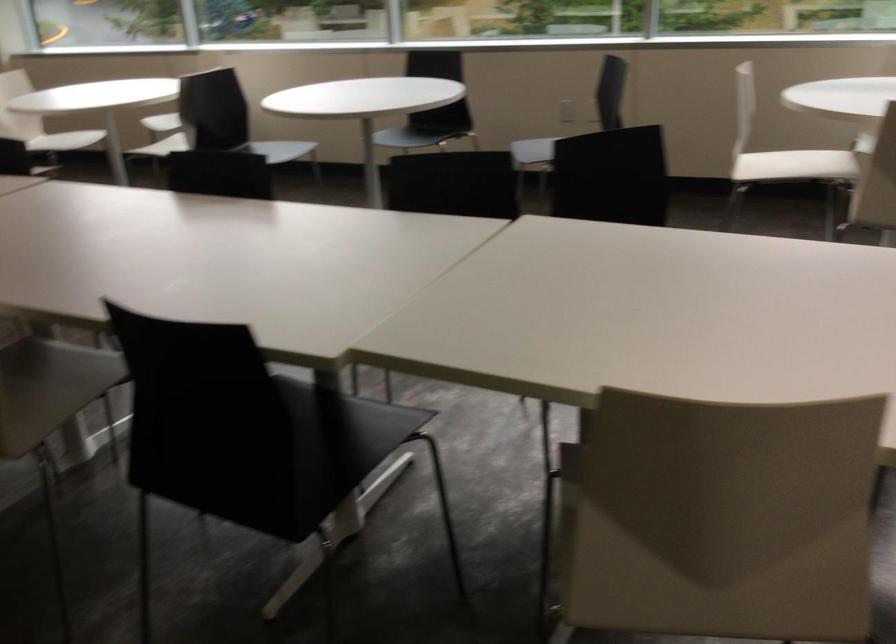
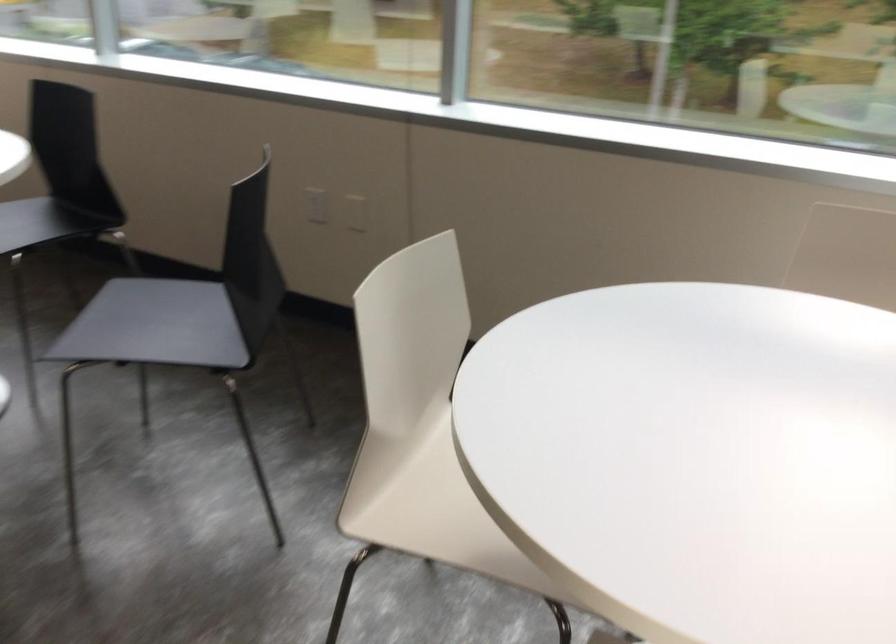
Where in the second image is the point corresponding to point (786, 164) from the first image?

(431, 509)